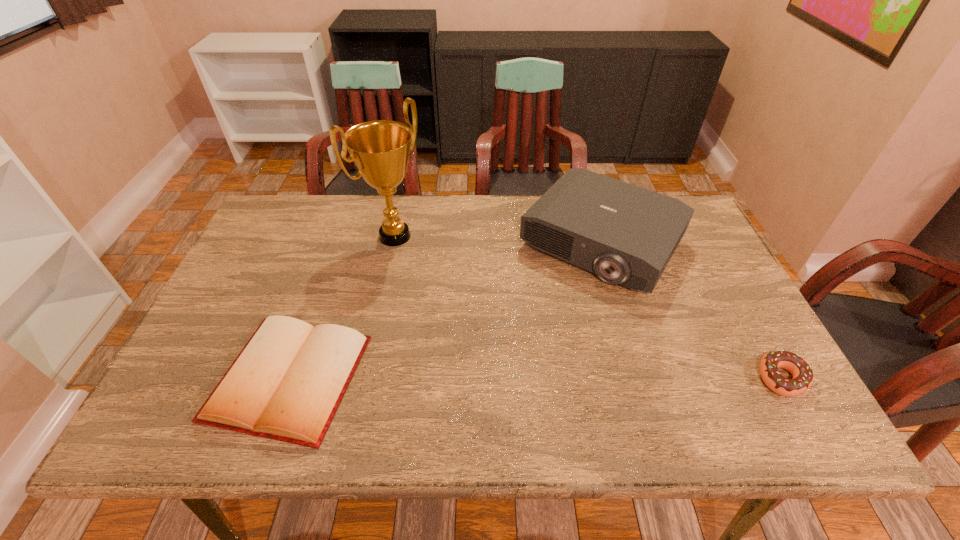
Where is `object that is at the near left corner`? object that is at the near left corner is located at coordinates click(x=286, y=384).

The height and width of the screenshot is (540, 960). Find the location of `object positioned at the far right corner`. object positioned at the far right corner is located at coordinates [626, 234].

Where is `object located at the near right corner`? object located at the near right corner is located at coordinates (802, 373).

The height and width of the screenshot is (540, 960). In the image, there is a desktop. What are the coordinates of `vacant space at the far edge` in the screenshot? It's located at (338, 219).

You are a GUI agent. You are given a task and a screenshot of the screen. Output one action in this format:
    pyautogui.click(x=<x>, y=<y>)
    Task: Click on the vacant region at the near edge of the desktop
    The height and width of the screenshot is (540, 960).
    Given the screenshot: What is the action you would take?
    pyautogui.click(x=372, y=384)

Where is `vacant space at the left edge`? The height and width of the screenshot is (540, 960). vacant space at the left edge is located at coordinates (256, 292).

The image size is (960, 540). Find the location of `vacant space at the right edge`. vacant space at the right edge is located at coordinates (750, 324).

The image size is (960, 540). I want to click on vacant space at the near left corner, so (201, 379).

Where is `free space between the tallest object and the third shortest object`? The width and height of the screenshot is (960, 540). free space between the tallest object and the third shortest object is located at coordinates (498, 240).

This screenshot has height=540, width=960. In order to click on free space between the projector and the doughnut in this screenshot , I will do `click(691, 310)`.